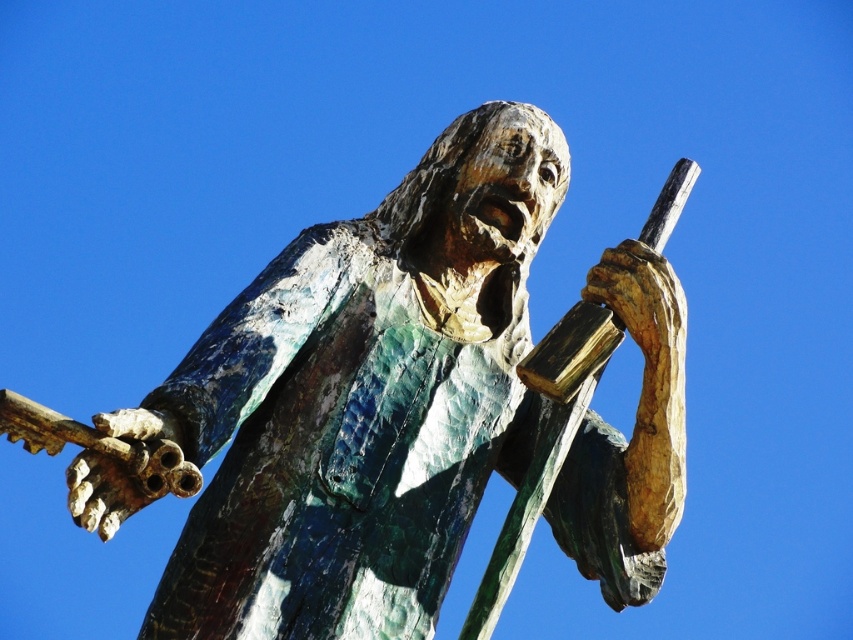
You are an art conservator examining the statue. You notice two points on the statue labeled as point 1 at coordinates point (471, 461) and point 2 at coordinates point (640, 317). Which point is closer to the front of the statue?

A: Point (640, 317) is closer to the front of the statue because it is in front of point (471, 461).

You are standing in front of a statue and want to take a photo of it. The statue is located at the center of the image. Where exactly should you aim your camera to capture the green patina statue at center?

You should aim your camera at point (361,400) to capture the green patina statue at center.

You are an art conservator assessing the statue. You need to determine if the green patina statue at center can be placed on a pedestal that is narrower than the bronze textured hand at upper right. Based on the spatial relationship between them, what is your conclusion?

The green patina statue at center might be wider than bronze textured hand at upper right, so the pedestal must be at least as wide as the statue to accommodate it. If the pedestal is narrower than the bronze textured hand at upper right, it might not be wide enough for the statue.